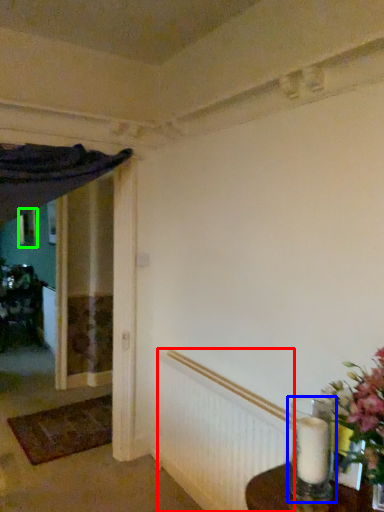
Question: Considering the real-world distances, which object is closest to radiator (highlighted by a red box)? candle holder (highlighted by a blue box) or picture frame (highlighted by a green box).

Choices:
 (A) candle holder
 (B) picture frame

Answer: (A)